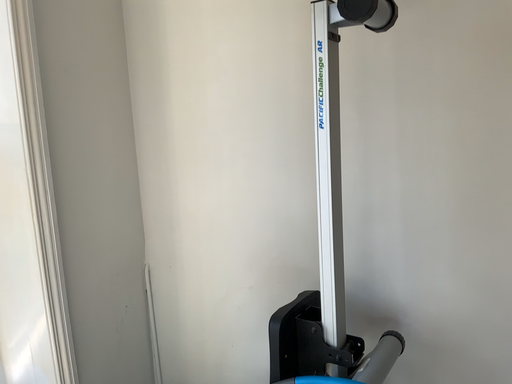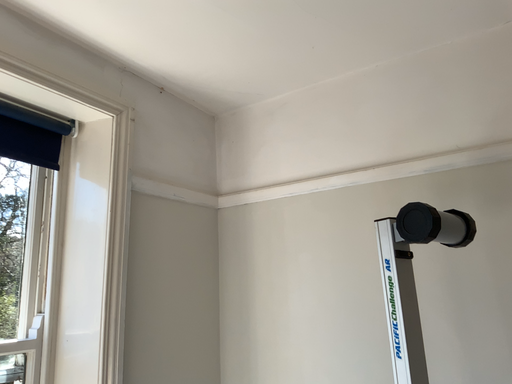
Question: Which way did the camera rotate in the video?

Choices:
 (A) rotated downward
 (B) rotated upward

Answer: (B)